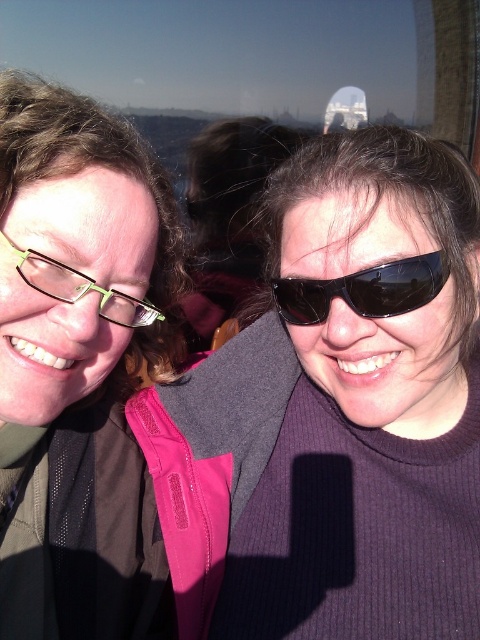
Question: Which of the following is the closest to the observer?

Choices:
 (A) (119, 288)
 (B) (39, 291)

Answer: (B)

Question: Which point is farther from the camera taking this photo?

Choices:
 (A) (399, 298)
 (B) (38, 570)

Answer: (B)

Question: Which object is positioned closest to the green plastic glasses at left?

Choices:
 (A) black reflective sunglasses at center
 (B) matte green glasses at left

Answer: (B)

Question: Is matte green glasses at left closer to camera compared to black reflective sunglasses at center?

Choices:
 (A) no
 (B) yes

Answer: (B)

Question: Is black reflective sunglasses at center bigger than green plastic glasses at left?

Choices:
 (A) no
 (B) yes

Answer: (A)

Question: Does matte green glasses at left come in front of green plastic glasses at left?

Choices:
 (A) no
 (B) yes

Answer: (A)